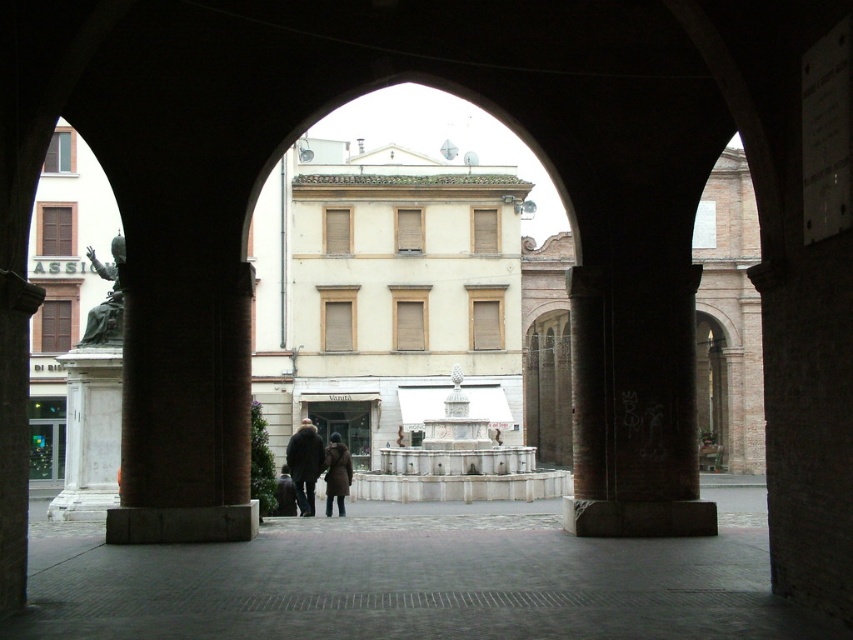
Is brown fuzzy coat at center bigger than brown leather coat at center?

Correct, brown fuzzy coat at center is larger in size than brown leather coat at center.

Image resolution: width=853 pixels, height=640 pixels. Describe the element at coordinates (335, 474) in the screenshot. I see `brown fuzzy coat at center` at that location.

You are a GUI agent. You are given a task and a screenshot of the screen. Output one action in this format:
    pyautogui.click(x=<x>, y=<y>)
    Task: Click on the brown fuzzy coat at center
    The image size is (853, 640).
    Given the screenshot: What is the action you would take?
    pyautogui.click(x=335, y=474)

Is point (119, 253) closer to camera compared to point (340, 515)?

No, (119, 253) is behind (340, 515).

Is point (120, 240) positioned after point (328, 451)?

No, it is in front of (328, 451).

Does point (103, 328) come closer to viewer compared to point (344, 467)?

That is True.

Locate an element on the screen. bronze statue at left is located at coordinates (106, 300).

Does bronze statue at left lie in front of brown leather coat at center?

Yes, bronze statue at left is closer to the viewer.

Does bronze statue at left appear on the left side of brown leather coat at center?

Correct, you'll find bronze statue at left to the left of brown leather coat at center.

Where is `bronze statue at left`? bronze statue at left is located at coordinates (106, 300).